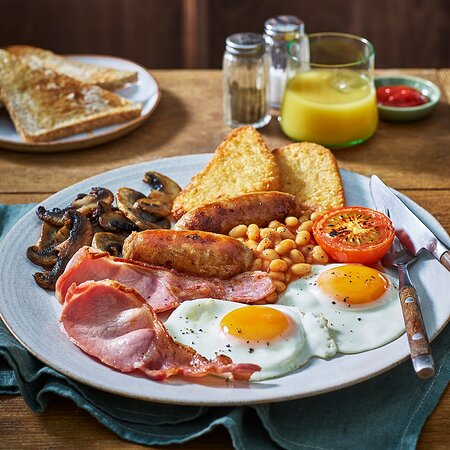
Locate an element on the screen. plate is located at coordinates (306, 385).